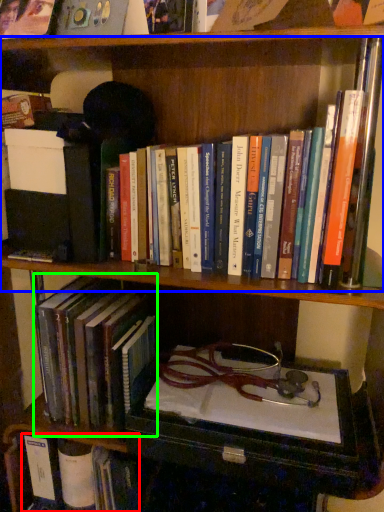
Question: Which object is the farthest from book (highlighted by a red box)? Choose among these: book (highlighted by a blue box) or book (highlighted by a green box).

Choices:
 (A) book
 (B) book

Answer: (A)